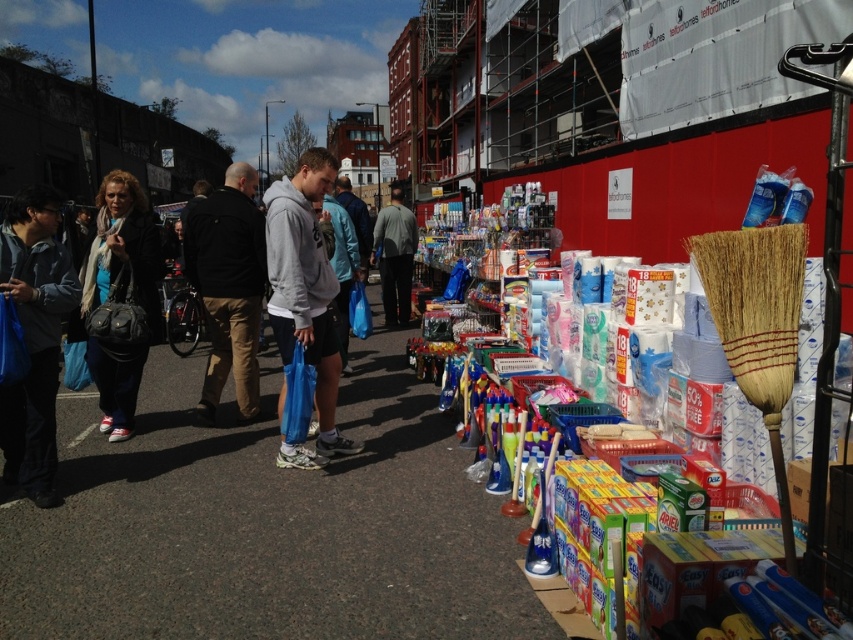
Question: Is gray matte hoodie at center smaller than black cotton jacket at center?

Choices:
 (A) yes
 (B) no

Answer: (A)

Question: Does blue fabric bag at left appear on the left side of gray matte hoodie at center?

Choices:
 (A) yes
 (B) no

Answer: (A)

Question: Based on their relative distances, which object is farther from the black leather handbag at left?

Choices:
 (A) gray fabric jacket at center
 (B) gray matte hoodie at center
 (C) blue fabric bag at left
 (D) black cotton jacket at center

Answer: (A)

Question: Which object is closer to the camera taking this photo?

Choices:
 (A) blue fabric bag at left
 (B) gray matte hoodie at center
 (C) gray fabric jacket at center

Answer: (A)

Question: Based on their relative distances, which object is nearer to the black cotton jacket at center?

Choices:
 (A) black leather handbag at left
 (B) blue fabric bag at left
 (C) gray matte hoodie at center

Answer: (A)

Question: Does blue fabric bag at left lie behind black cotton jacket at center?

Choices:
 (A) no
 (B) yes

Answer: (A)